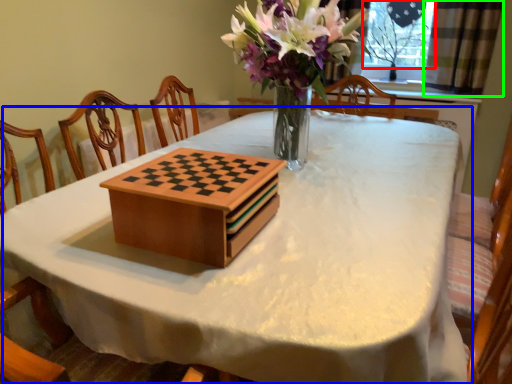
Question: Estimate the real-world distances between objects in this image. Which object is farther from window screen (highlighted by a red box), table (highlighted by a blue box) or curtain (highlighted by a green box)?

Choices:
 (A) table
 (B) curtain

Answer: (A)